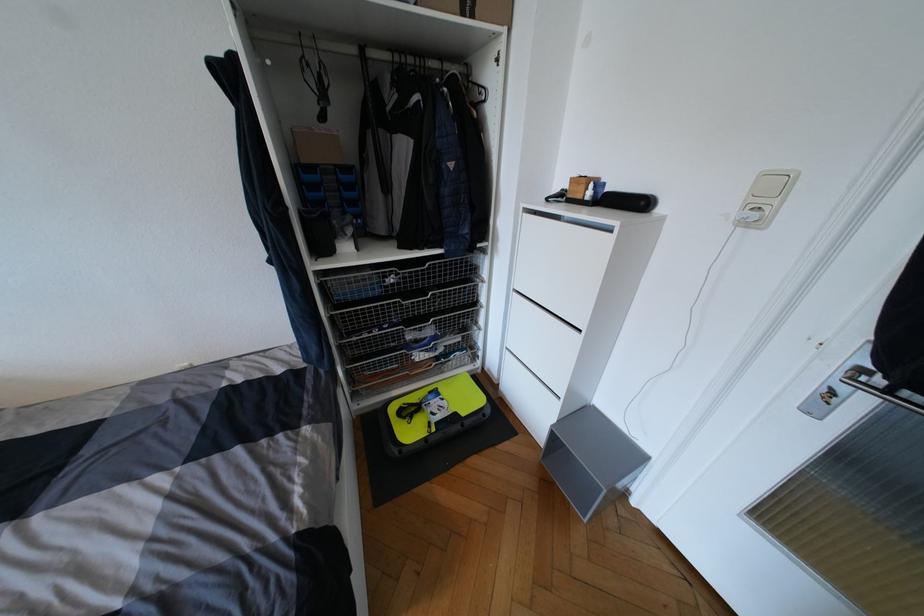
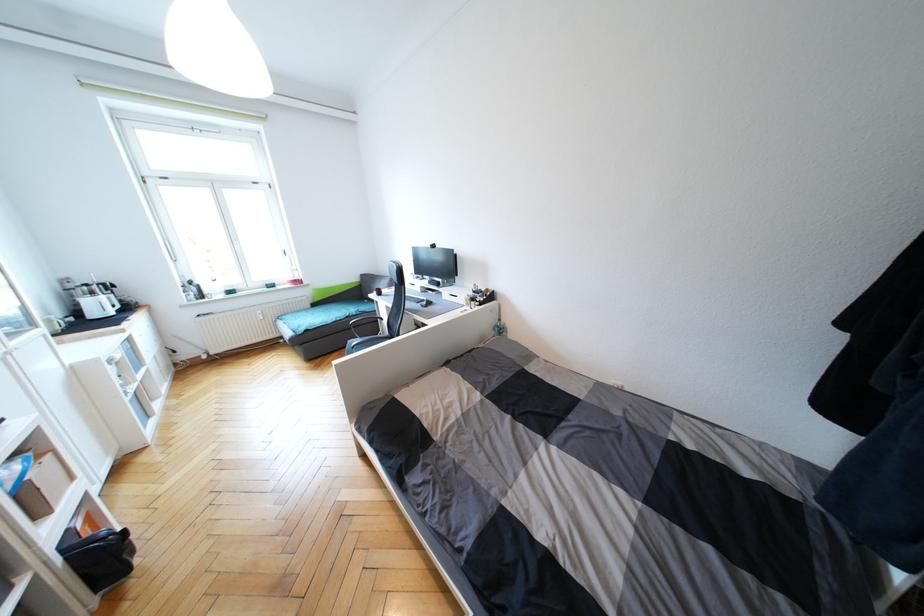
Question: The images are taken continuously from a first-person perspective. In which direction is your viewpoint rotating?

Choices:
 (A) Left
 (B) Right
 (C) Up
 (D) Down

Answer: (A)